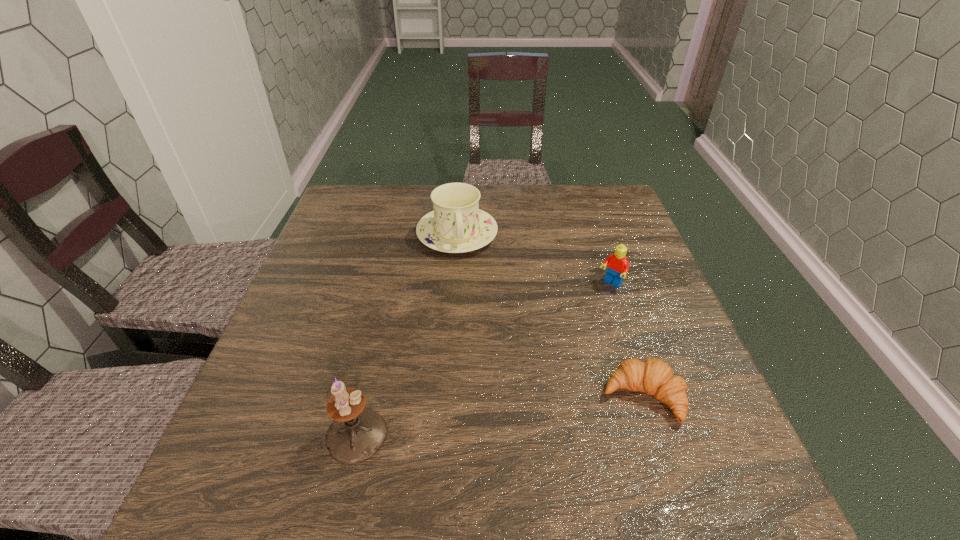
This screenshot has height=540, width=960. I want to click on free region located on the face of the third nearest object, so click(586, 311).

The height and width of the screenshot is (540, 960). In order to click on free space located on the face of the third nearest object in this screenshot , I will do `click(582, 316)`.

Locate an element on the screen. object that is at the far edge is located at coordinates (457, 225).

This screenshot has height=540, width=960. Find the location of `candle holder that is at the near edge`. candle holder that is at the near edge is located at coordinates (357, 433).

The image size is (960, 540). I want to click on crescent roll at the near edge, so click(653, 376).

Where is `crescent roll that is at the right edge`? The image size is (960, 540). crescent roll that is at the right edge is located at coordinates (653, 376).

Find the location of a particular element. Lego located at the right edge is located at coordinates (617, 265).

Where is `object that is positioned at the near right corner`? object that is positioned at the near right corner is located at coordinates (653, 376).

The width and height of the screenshot is (960, 540). What are the coordinates of `free location at the far edge of the desktop` in the screenshot? It's located at (517, 212).

In the image, there is a desktop. Where is `blank space at the near edge`? blank space at the near edge is located at coordinates (414, 444).